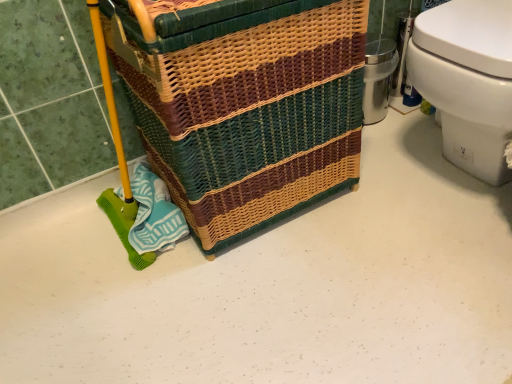
The image size is (512, 384). I want to click on vacant area that is situated to the right of woven wicker basket at center, so click(398, 191).